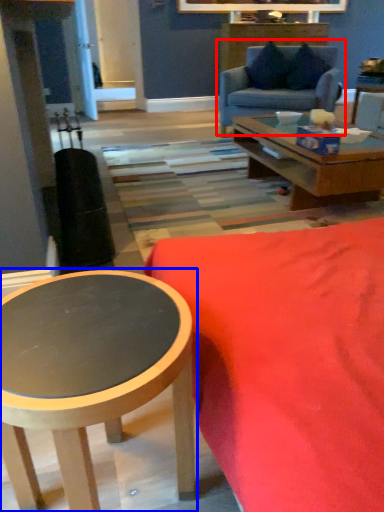
Question: Which object is further to the camera taking this photo, studio couch (highlighted by a red box) or coffee table (highlighted by a blue box)?

Choices:
 (A) studio couch
 (B) coffee table

Answer: (A)